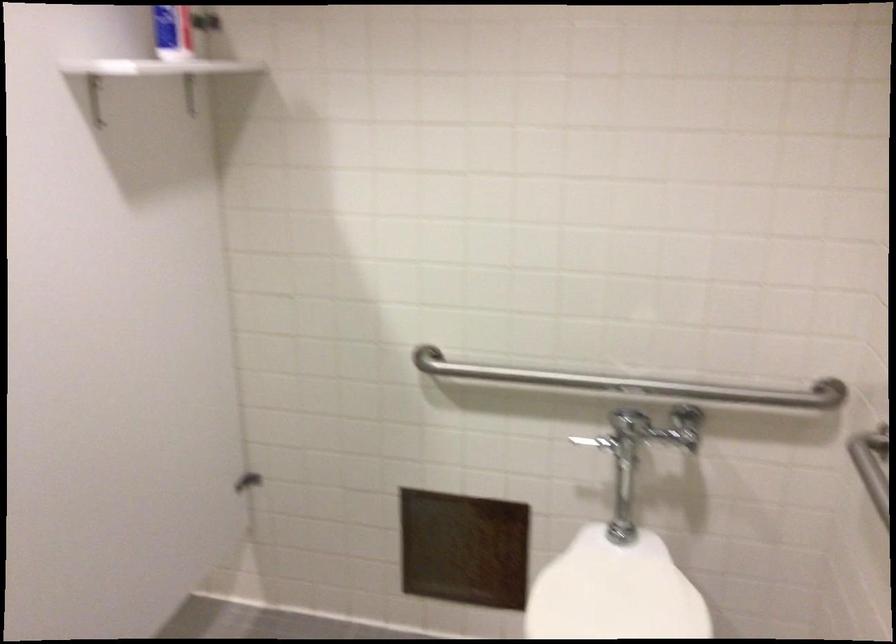
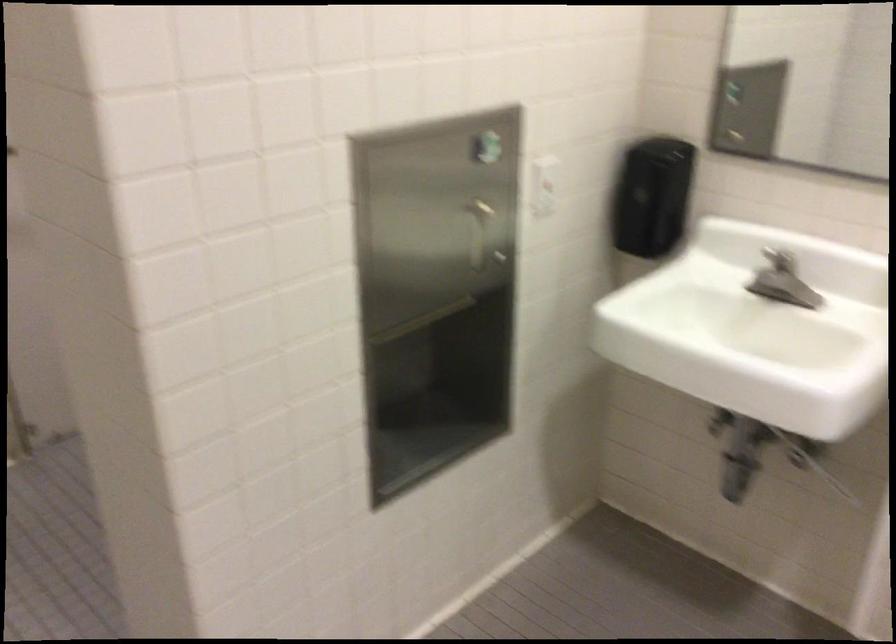
Question: In a continuous first-person perspective shot, in which direction is the camera moving?

Choices:
 (A) Left
 (B) Right
 (C) Forward
 (D) Backward

Answer: (A)